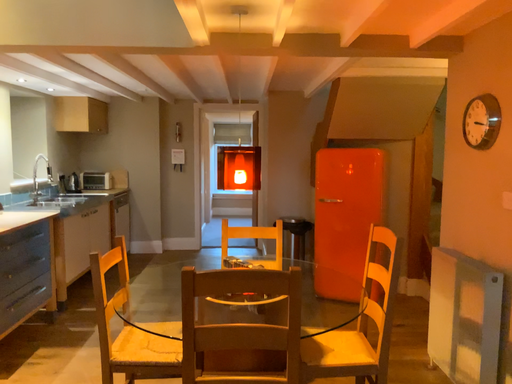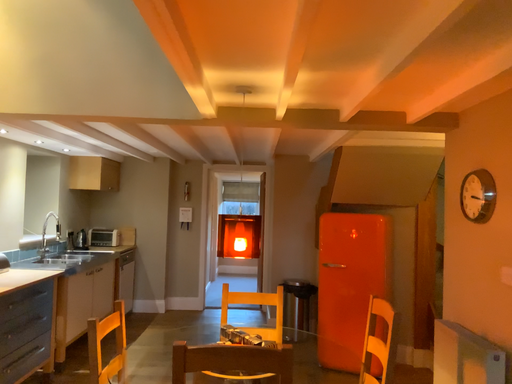
Question: Which way did the camera rotate in the video?

Choices:
 (A) rotated upward
 (B) rotated downward

Answer: (A)